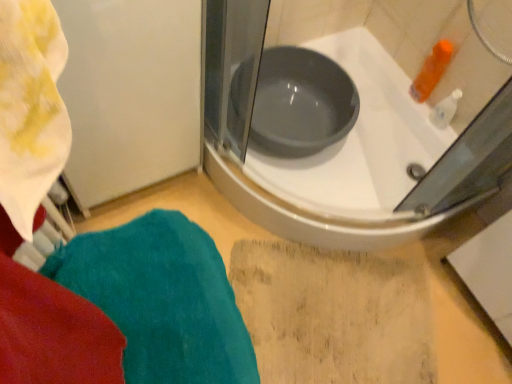
Question: Is matte gray basin at center surrounding teal plush towel at lower left?

Choices:
 (A) yes
 (B) no

Answer: (B)

Question: Is matte gray basin at center shorter than teal plush towel at lower left?

Choices:
 (A) yes
 (B) no

Answer: (A)

Question: From the image's perspective, is matte gray basin at center below teal plush towel at lower left?

Choices:
 (A) no
 (B) yes

Answer: (A)

Question: Is matte gray basin at center to the right of teal plush towel at lower left from the viewer's perspective?

Choices:
 (A) yes
 (B) no

Answer: (A)

Question: Is matte gray basin at center oriented away from teal plush towel at lower left?

Choices:
 (A) yes
 (B) no

Answer: (B)

Question: Is matte gray basin at center with teal plush towel at lower left?

Choices:
 (A) yes
 (B) no

Answer: (B)

Question: Is teal plush towel at lower left to the left of white glossy bathtub at upper center from the viewer's perspective?

Choices:
 (A) yes
 (B) no

Answer: (A)

Question: From a real-world perspective, is teal plush towel at lower left positioned over white glossy bathtub at upper center based on gravity?

Choices:
 (A) yes
 (B) no

Answer: (A)

Question: Considering the relative sizes of teal plush towel at lower left and white glossy bathtub at upper center in the image provided, is teal plush towel at lower left taller than white glossy bathtub at upper center?

Choices:
 (A) yes
 (B) no

Answer: (A)

Question: Is white glossy bathtub at upper center located within teal plush towel at lower left?

Choices:
 (A) yes
 (B) no

Answer: (B)

Question: Does teal plush towel at lower left appear on the right side of white glossy bathtub at upper center?

Choices:
 (A) no
 (B) yes

Answer: (A)

Question: Is teal plush towel at lower left turned away from white glossy bathtub at upper center?

Choices:
 (A) no
 (B) yes

Answer: (A)

Question: Is white glossy bathtub at upper center bigger than teal plush towel at lower left?

Choices:
 (A) yes
 (B) no

Answer: (A)